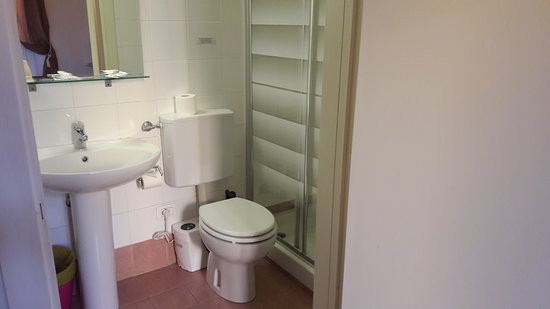
You are a GUI agent. You are given a task and a screenshot of the screen. Output one action in this format:
    pyautogui.click(x=<x>, y=<y>)
    Task: Click on the soap dispenser
    The width and height of the screenshot is (550, 309).
    Given the screenshot: What is the action you would take?
    pyautogui.click(x=62, y=76)